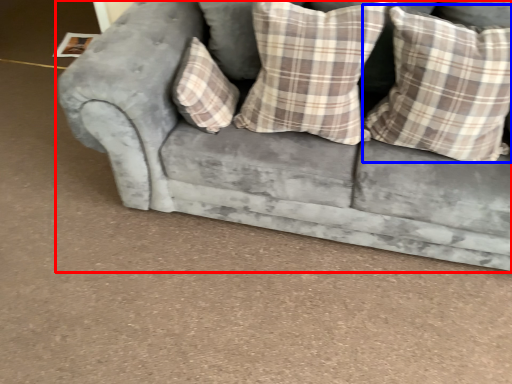
Question: Among these objects, which one is farthest to the camera, studio couch (highlighted by a red box) or pillow (highlighted by a blue box)?

Choices:
 (A) studio couch
 (B) pillow

Answer: (B)